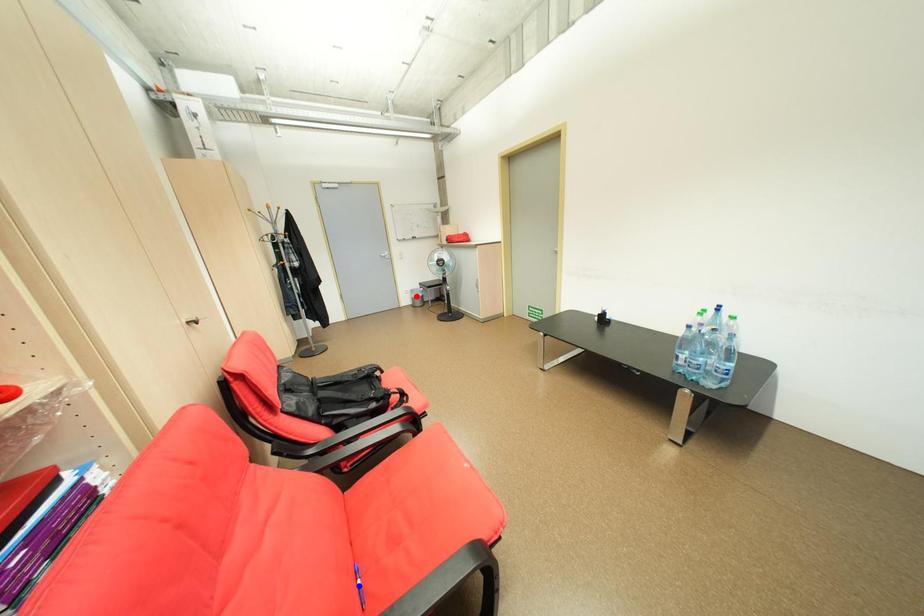
Question: Which of the two points in the image is closer to the camera?

Choices:
 (A) Blue point is closer.
 (B) Red point is closer.

Answer: (A)